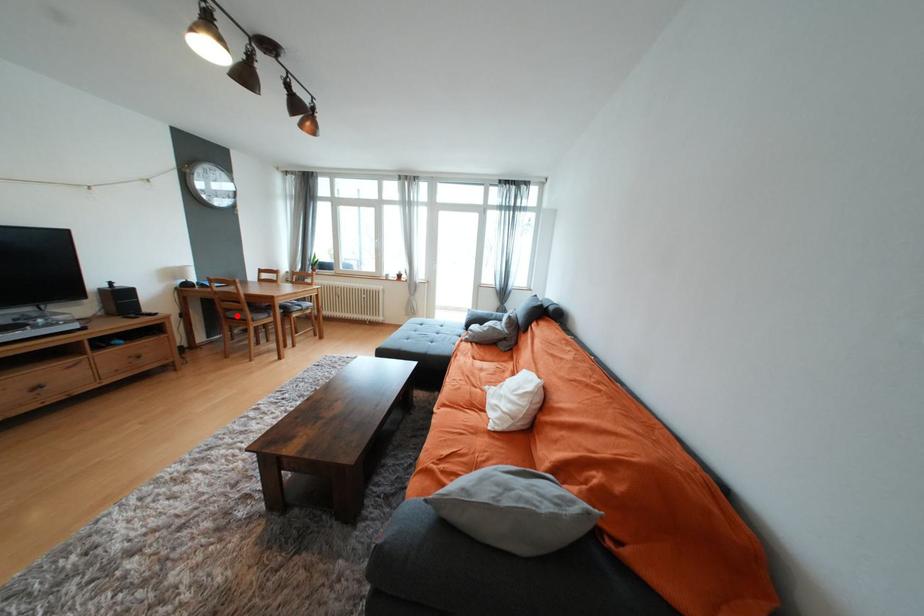
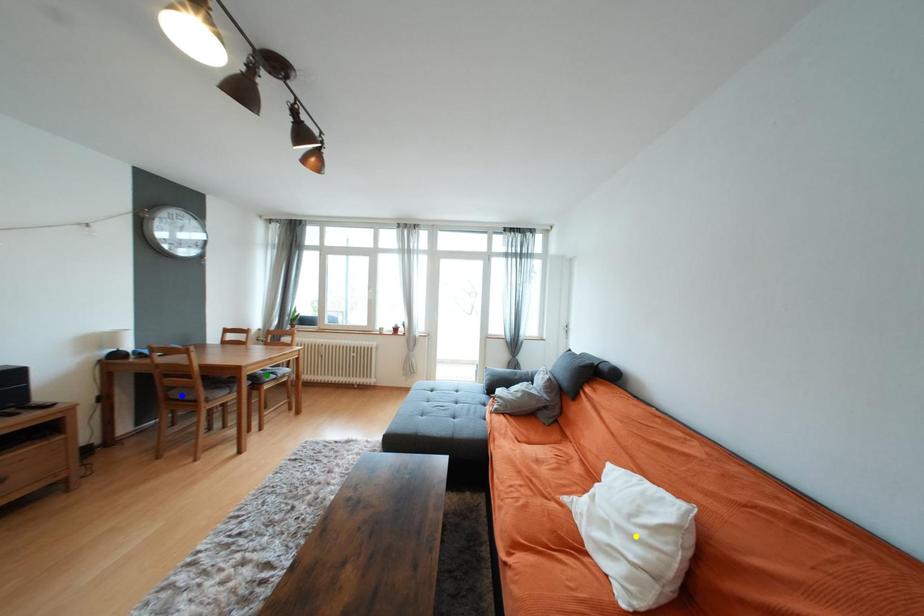
Question: I am providing you with two images of the same scene from different viewpoints. A red point is marked on the first image. You are given multiple points on the second image. Can you choose the point in image 2 that corresponds to the point in image 1?

Choices:
 (A) yellow point
 (B) green point
 (C) blue point

Answer: (C)